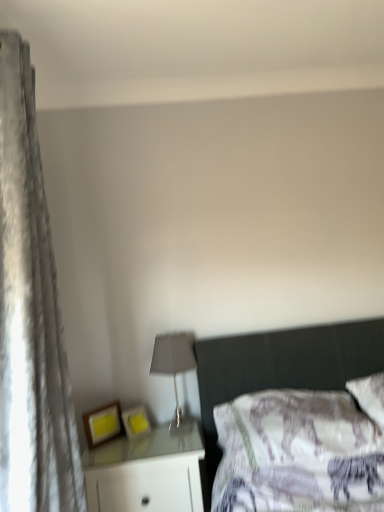
Question: Based on their sizes in the image, would you say white glossy nightstand at lower left is bigger or smaller than matte wooden picture frame at lower left, which is the first picture frame in left-to-right order?

Choices:
 (A) small
 (B) big

Answer: (B)

Question: From the image's perspective, is white glossy nightstand at lower left positioned above or below matte wooden picture frame at lower left, which is the first picture frame in left-to-right order?

Choices:
 (A) above
 (B) below

Answer: (B)

Question: Estimate the real-world distances between objects in this image. Which object is farther from the white glossy nightstand at lower left?

Choices:
 (A) velvet gray curtain at left
 (B) matte yellow picture frame at lower center, the 2th picture frame in the left-to-right sequence
 (C) matte wooden picture frame at lower left, which is the first picture frame in left-to-right order
 (D) matte gray lampshade at center

Answer: (A)

Question: Which is nearer to the matte gray lampshade at center?

Choices:
 (A) matte yellow picture frame at lower center, the 2th picture frame in the left-to-right sequence
 (B) white glossy nightstand at lower left
 (C) velvet gray curtain at left
 (D) matte wooden picture frame at lower left, which is the first picture frame in left-to-right order

Answer: (A)